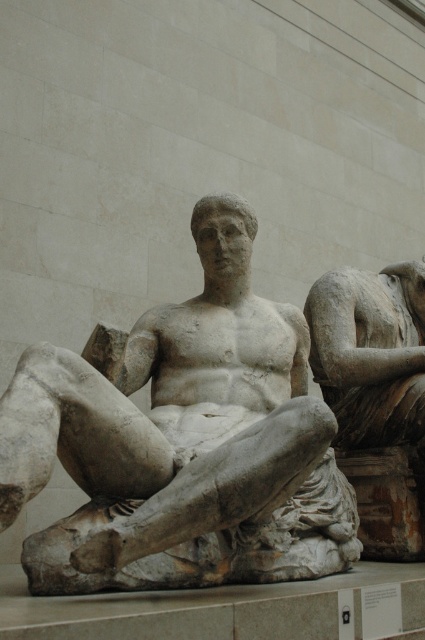
Is white marble statue at center smaller than matte stone reclining figure at center?

Incorrect, white marble statue at center is not smaller in size than matte stone reclining figure at center.

Between white marble statue at center and matte stone reclining figure at center, which one has less height?

matte stone reclining figure at center is shorter.

Measure the distance between white marble statue at center and camera.

They are 23.51 meters apart.

Where is `white marble statue at center`? white marble statue at center is located at coordinates (183, 440).